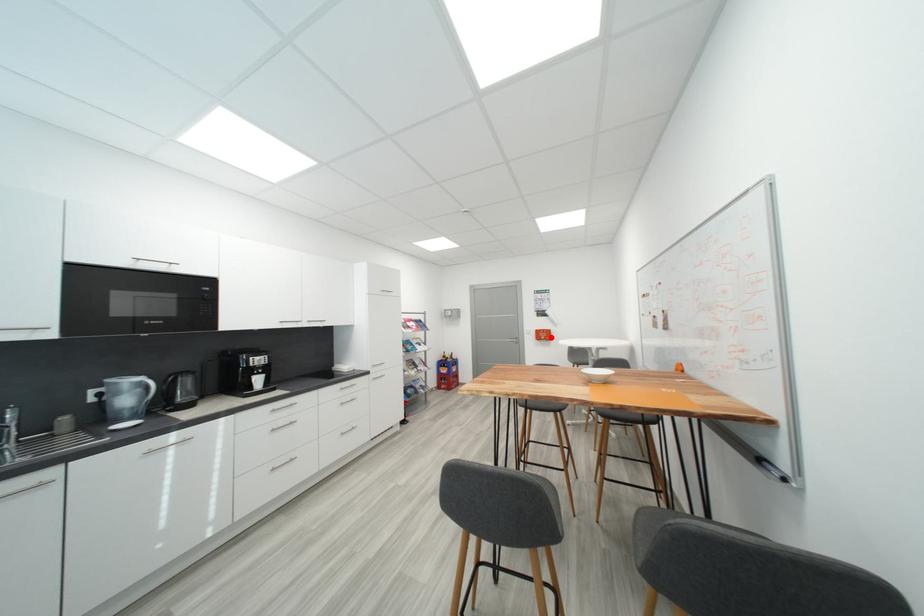
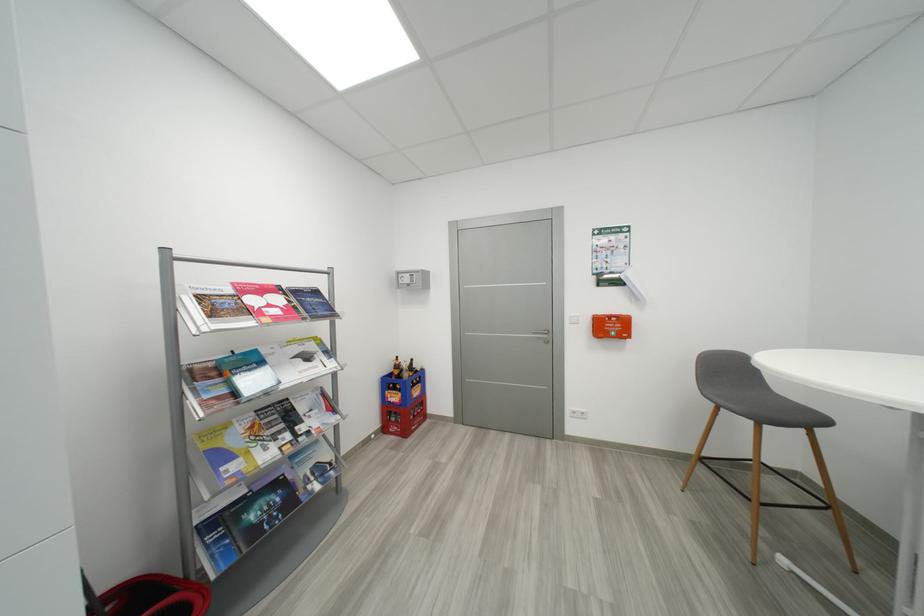
Question: I am providing you with two images of the same scene from different viewpoints. Given a red point in image1, look at the same physical point in image2. Is it:

Choices:
 (A) Closer to the viewpoint
 (B) Farther from the viewpoint

Answer: (A)